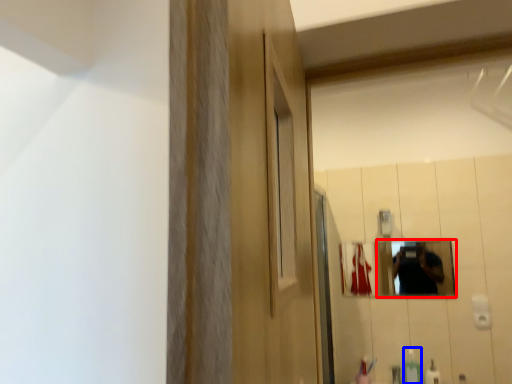
Question: Which object is further to the camera taking this photo, mirror (highlighted by a red box) or soap dispenser (highlighted by a blue box)?

Choices:
 (A) mirror
 (B) soap dispenser

Answer: (A)